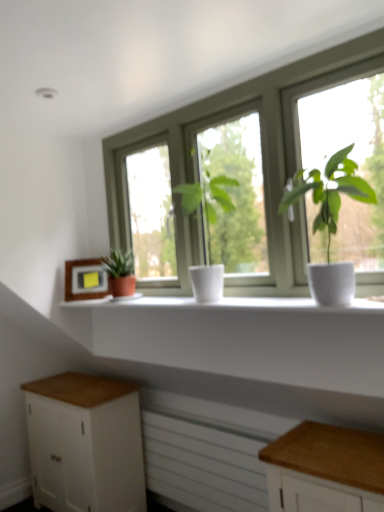
Question: From the image's perspective, is white matte plant pot at center, the 3th houseplant from the left, positioned above or below green matte plant at left, which is counted as the third houseplant, starting from the front?

Choices:
 (A) above
 (B) below

Answer: (A)

Question: In the image, is white matte plant pot at center, marked as the third houseplant in a back-to-front arrangement, positioned in front of or behind green matte plant at left, the first houseplant positioned from the left?

Choices:
 (A) front
 (B) behind

Answer: (A)

Question: Which object is the closest to the white matte window sill at center?

Choices:
 (A) white matte plant pot at center, the 1th houseplant positioned from the right
 (B) white matte window at center
 (C) wooden frame at left
 (D) white wood cabinet at lower left
 (E) white matte radiator at lower center

Answer: (C)

Question: Which of these objects is positioned farthest from the white matte plant pot at center, positioned as the second houseplant in front-to-back order?

Choices:
 (A) wooden frame at left
 (B) white matte window sill at center
 (C) green matte plant at left, marked as the third houseplant in a right-to-left arrangement
 (D) white matte plant pot at center, the 1th houseplant positioned from the right
 (E) white matte radiator at lower center

Answer: (E)